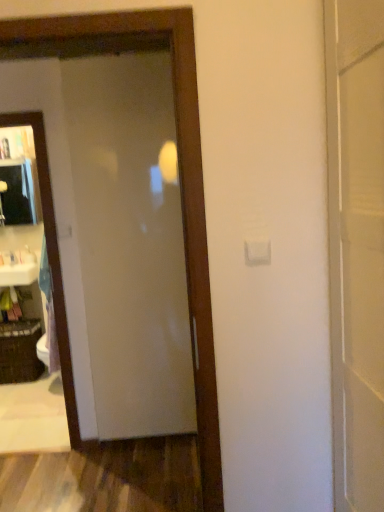
Question: From a real-world perspective, is clear glass mirror at left beneath black woven basket at lower left?

Choices:
 (A) yes
 (B) no

Answer: (B)

Question: Is clear glass mirror at left wider than black woven basket at lower left?

Choices:
 (A) no
 (B) yes

Answer: (A)

Question: Does clear glass mirror at left touch black woven basket at lower left?

Choices:
 (A) no
 (B) yes

Answer: (A)

Question: Is black woven basket at lower left completely or partially inside clear glass mirror at left?

Choices:
 (A) no
 (B) yes

Answer: (A)

Question: Considering the relative sizes of clear glass mirror at left and black woven basket at lower left in the image provided, is clear glass mirror at left taller than black woven basket at lower left?

Choices:
 (A) yes
 (B) no

Answer: (A)

Question: Is matte glass door at center wider or thinner than white plastic bag at left?

Choices:
 (A) wide
 (B) thin

Answer: (B)

Question: From the image's perspective, is matte glass door at center above or below white plastic bag at left?

Choices:
 (A) below
 (B) above

Answer: (A)

Question: Is matte glass door at center bigger or smaller than white plastic bag at left?

Choices:
 (A) small
 (B) big

Answer: (B)

Question: Is matte glass door at center situated inside white plastic bag at left or outside?

Choices:
 (A) outside
 (B) inside

Answer: (A)

Question: From the image's perspective, is white plastic bag at left located above or below black woven basket at lower left?

Choices:
 (A) below
 (B) above

Answer: (B)

Question: In terms of size, does white plastic bag at left appear bigger or smaller than black woven basket at lower left?

Choices:
 (A) small
 (B) big

Answer: (A)

Question: Is point (23, 247) positioned closer to the camera than point (21, 291)?

Choices:
 (A) farther
 (B) closer

Answer: (B)

Question: Relative to black woven basket at lower left, is white plastic bag at left in front or behind?

Choices:
 (A) front
 (B) behind

Answer: (B)

Question: In terms of width, does matte glass door at center look wider or thinner when compared to white glossy sink at left?

Choices:
 (A) wide
 (B) thin

Answer: (B)

Question: In terms of height, does matte glass door at center look taller or shorter compared to white glossy sink at left?

Choices:
 (A) short
 (B) tall

Answer: (B)